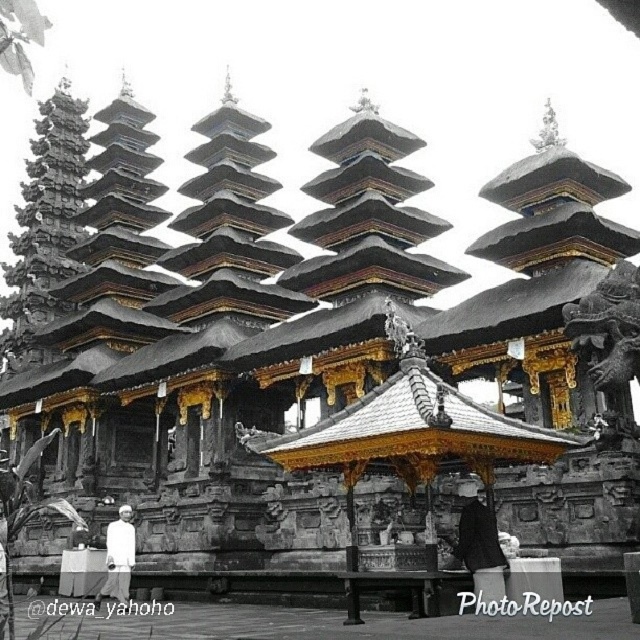
You are a visitor at the Balinese temple and want to place your dark gray fabric coat at center on the white cloth at lower left. Given that the temple has a strict rule against moving objects more than 100 feet, can you legally move your coat to the cloth?

The dark gray fabric coat at center and white cloth at lower left are 124.66 feet apart. Since the temple rule states objects cannot be moved more than 100 feet, moving the coat would violate the rule. Please find another location within the 100 feet limit.

You are a visitor at the temple and want to place a small offering on the altar. You have both the dark gray fabric coat at center and the white cloth at lower left. Which cloth is more suitable for covering the offering to ensure it stays visible?

The white cloth at lower left is more suitable because it is thicker than the dark gray fabric coat at center, making it better at concealing the offering while still allowing visibility.

You are standing in front of the Balinese temple and notice two points marked on the temple structure. The first point is at coordinates point (496,563) and the second is at point (118,531). Which of these points is positioned closer to your viewpoint?

Point (496,563) is closer to the viewer than point (118,531).